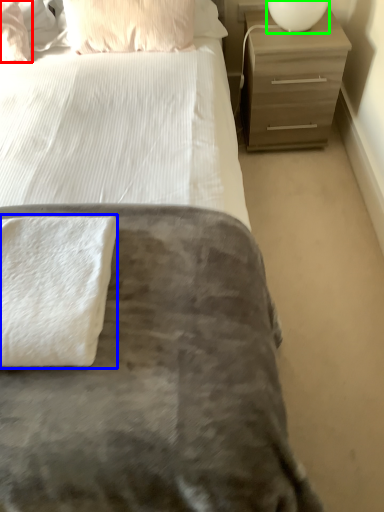
Question: Which object is positioned farthest from pillow (highlighted by a red box)? Select from bath towel (highlighted by a blue box) and bedside lamp (highlighted by a green box).

Choices:
 (A) bath towel
 (B) bedside lamp

Answer: (A)